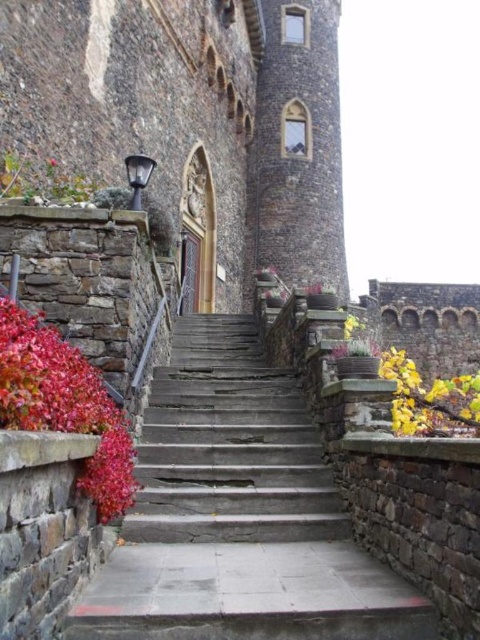
Question: Observing the image, what is the correct spatial positioning of stone stairs at center in reference to dark brown stone tower at upper center?

Choices:
 (A) below
 (B) above

Answer: (A)

Question: Based on their relative distances, which object is farther from the stone stairs at center?

Choices:
 (A) vivid red leaves at left
 (B) dark brown stone tower at upper center

Answer: (B)

Question: Does stone stairs at center have a larger size compared to vivid red leaves at left?

Choices:
 (A) yes
 (B) no

Answer: (A)

Question: Which of the following is the farthest from the observer?

Choices:
 (A) vivid red leaves at left
 (B) dark brown stone tower at upper center

Answer: (B)

Question: Does dark brown stone tower at upper center appear under vivid red leaves at left?

Choices:
 (A) no
 (B) yes

Answer: (A)

Question: Which of the following is the closest to the observer?

Choices:
 (A) (292, 36)
 (B) (206, 360)

Answer: (B)